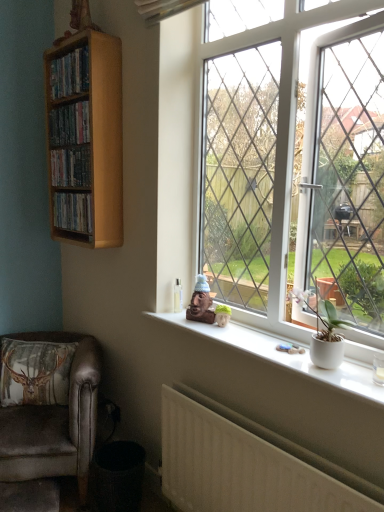
Based on the photo, measure the distance between point (328, 314) and camera.

The distance of point (328, 314) from camera is 1.48 meters.

This screenshot has width=384, height=512. What do you see at coordinates (85, 139) in the screenshot?
I see `wooden bookshelf at upper left` at bounding box center [85, 139].

What do you see at coordinates (69, 124) in the screenshot? I see `wooden shelf at upper left, which appears as the third book when ordered from the bottom` at bounding box center [69, 124].

The height and width of the screenshot is (512, 384). What are the coordinates of `wooden shelf at upper left, which appears as the third book when ordered from the bottom` in the screenshot? It's located at (69, 124).

The height and width of the screenshot is (512, 384). Identify the location of white matte pot at window. (324, 332).

Would you consider wooden bookshelf at upper left to be distant from wooden shelf at upper left, which appears as the third book when ordered from the bottom?

That's not correct — wooden bookshelf at upper left is a little close to wooden shelf at upper left, which appears as the third book when ordered from the bottom.

The height and width of the screenshot is (512, 384). Identify the location of the 3rd book to the right when counting from the wooden bookshelf at upper left. pos(69,124).

From a real-world perspective, is wooden bookshelf at upper left under wooden shelf at upper left, which appears as the third book when ordered from the bottom?

Yes.

Which of these two, wooden bookshelf at upper left or wooden shelf at upper left, positioned as the 1th book in top-to-bottom order, is bigger?

wooden bookshelf at upper left.

From the image's perspective, does white plastic window at center appear lower than velvet brown armchair at lower left?

No, from the image's perspective, white plastic window at center is not below velvet brown armchair at lower left.

What's the angular difference between white plastic window at center and velvet brown armchair at lower left's facing directions?

There is a 56.4-degree angle between the facing directions of white plastic window at center and velvet brown armchair at lower left.

From a real-world perspective, which is physically below, white plastic window at center or velvet brown armchair at lower left?

From a 3D spatial view, velvet brown armchair at lower left is below.

Is point (265, 42) positioned in front of point (34, 426)?

That is True.

From a real-world perspective, which object rests below the other?

velvet brown armchair at lower left, from a real-world perspective.

Looking at this image, is there a large distance between velvet brown armchair at lower left and wooden shelf at left, the 2th book viewed from the top?

Yes, velvet brown armchair at lower left is far from wooden shelf at left, the 2th book viewed from the top.

From the image's perspective, which is below, velvet brown armchair at lower left or wooden shelf at left, the 2th book viewed from the top?

velvet brown armchair at lower left is shown below in the image.

Considering the sizes of objects velvet brown armchair at lower left and wooden shelf at left, the 2th book viewed from the top, in the image provided, who is thinner, velvet brown armchair at lower left or wooden shelf at left, the 2th book viewed from the top,?

wooden shelf at left, the 2th book viewed from the top, is thinner.

From a real-world perspective, which object stands above the other?

wooden bookshelf at upper left.

Is wooden bookshelf at upper left bigger or smaller than velvet brown armchair at lower left?

In the image, wooden bookshelf at upper left appears to be smaller than velvet brown armchair at lower left.

Can you confirm if wooden bookshelf at upper left is thinner than velvet brown armchair at lower left?

Correct, the width of wooden bookshelf at upper left is less than that of velvet brown armchair at lower left.

Consider the image. What's the angular difference between wooden bookshelf at upper left and velvet brown armchair at lower left's facing directions?

54.2 degrees.

Is white plastic window at center far away from white textured radiator at lower center?

No, there isn't a large distance between white plastic window at center and white textured radiator at lower center.

Between white plastic window at center and white textured radiator at lower center, which one has more height?

white plastic window at center.

Looking at this image, from the image's perspective, is white plastic window at center on top of white textured radiator at lower center?

Yes.

How many degrees apart are the facing directions of white plastic window at center and white textured radiator at lower center?

white plastic window at center and white textured radiator at lower center are facing 1.65 degrees away from each other.

Is white textured radiator at lower center beside velvety brown pillow at lower left?

No, white textured radiator at lower center is not beside velvety brown pillow at lower left.

What's the angular difference between white textured radiator at lower center and velvety brown pillow at lower left's facing directions?

There is a 54.6-degree angle between the facing directions of white textured radiator at lower center and velvety brown pillow at lower left.

Considering the sizes of objects white textured radiator at lower center and velvety brown pillow at lower left in the image provided, who is smaller, white textured radiator at lower center or velvety brown pillow at lower left?

Smaller between the two is white textured radiator at lower center.

Considering the sizes of matte brown statue at center and velvety brown pillow at lower left in the image, is matte brown statue at center bigger or smaller than velvety brown pillow at lower left?

Considering their sizes, matte brown statue at center takes up less space than velvety brown pillow at lower left.

Based on the photo, is matte brown statue at center inside the boundaries of velvety brown pillow at lower left, or outside?

The correct answer is: outside.

Can you confirm if matte brown statue at center is taller than velvety brown pillow at lower left?

No, matte brown statue at center is not taller than velvety brown pillow at lower left.

Where is `book above the wooden bookshelf at upper left (from a real-world perspective)`? book above the wooden bookshelf at upper left (from a real-world perspective) is located at coordinates (69, 124).

The image size is (384, 512). What are the coordinates of `window on the right of velvet brown armchair at lower left` in the screenshot? It's located at (278, 117).

In the scene shown: From the image, which object appears to be nearer to wooden bookshelf at upper left, wooden shelf at upper left, which ranks as the first book in bottom-to-top order, or wooden shelf at left, which ranks as the second book in bottom-to-top order?

Among the two, wooden shelf at left, which ranks as the second book in bottom-to-top order, is located nearer to wooden bookshelf at upper left.

When comparing their distances from wooden bookshelf at upper left, does white plastic window at center or wooden shelf at upper left, the 3th book positioned from the top, seem closer?

wooden shelf at upper left, the 3th book positioned from the top, is positioned closer to the anchor wooden bookshelf at upper left.

In the scene shown: Looking at the image, which one is located further to white plastic window at center, wooden shelf at upper left, which appears as the third book when ordered from the bottom, or wooden shelf at left, which ranks as the second book in bottom-to-top order?

Based on the image, wooden shelf at upper left, which appears as the third book when ordered from the bottom, appears to be further to white plastic window at center.

Considering their positions, is wooden bookshelf at upper left positioned closer to wooden shelf at upper left, which ranks as the first book in bottom-to-top order, than white matte pot at window?

wooden bookshelf at upper left lies closer to wooden shelf at upper left, which ranks as the first book in bottom-to-top order, than the other object.

In the scene shown: From the image, which object appears to be farther from matte brown statue at center, white textured radiator at lower center or white plastic window at center?

white plastic window at center is further to matte brown statue at center.

Estimate the real-world distances between objects in this image. Which object is closer to velvet brown armchair at lower left, wooden shelf at upper left, positioned as the 1th book in top-to-bottom order, or velvety brown pillow at lower left?

Among the two, velvety brown pillow at lower left is located nearer to velvet brown armchair at lower left.

Considering their positions, is velvet brown armchair at lower left positioned further to wooden bookshelf at upper left than wooden shelf at upper left, which appears as the third book when ordered from the bottom?

velvet brown armchair at lower left is further to wooden bookshelf at upper left.

From the image, which object appears to be nearer to matte brown statue at center, white textured radiator at lower center or velvet brown armchair at lower left?

The object closer to matte brown statue at center is white textured radiator at lower center.

The image size is (384, 512). Identify the location of toy between white plastic window at center and white textured radiator at lower center vertically. (201, 302).

In order to click on toy between wooden shelf at left, which ranks as the second book in bottom-to-top order, and velvety brown pillow at lower left from top to bottom in this screenshot , I will do `click(201, 302)`.

At what (x,y) coordinates should I click in order to perform the action: click on toy that lies between wooden shelf at left, which ranks as the second book in bottom-to-top order, and white textured radiator at lower center from top to bottom. Please return your answer as a coordinate pair (x, y). The width and height of the screenshot is (384, 512). Looking at the image, I should click on (201, 302).

The width and height of the screenshot is (384, 512). What are the coordinates of `book between wooden shelf at left, the 2th book viewed from the top, and white matte pot at window, in the horizontal direction` in the screenshot? It's located at (69, 124).